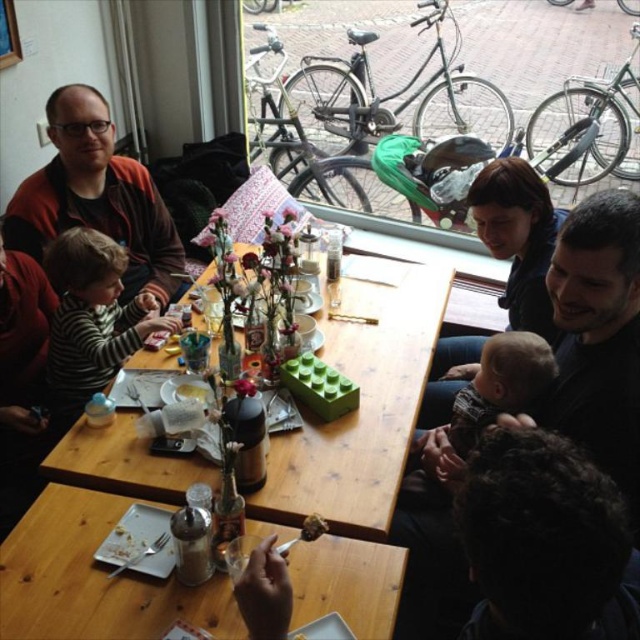
Question: Is wooden table at center wider than wooden table at lower center?

Choices:
 (A) no
 (B) yes

Answer: (B)

Question: Does matte red sweater at upper left appear on the left side of soft beige baby at center?

Choices:
 (A) yes
 (B) no

Answer: (A)

Question: Which is farther from the soft beige baby at center?

Choices:
 (A) wooden table at lower center
 (B) striped cotton shirt at left

Answer: (B)

Question: Which point appears farthest from the camera in this image?

Choices:
 (A) (326, 356)
 (B) (508, 412)
 (C) (164, 593)
 (D) (74, 408)

Answer: (D)

Question: Can you confirm if striped cotton shirt at left is positioned to the right of soft beige baby at center?

Choices:
 (A) no
 (B) yes

Answer: (A)

Question: Which of these objects is positioned closest to the matte red sweater at upper left?

Choices:
 (A) wooden table at lower center
 (B) soft beige baby at center
 (C) wooden table at center

Answer: (C)